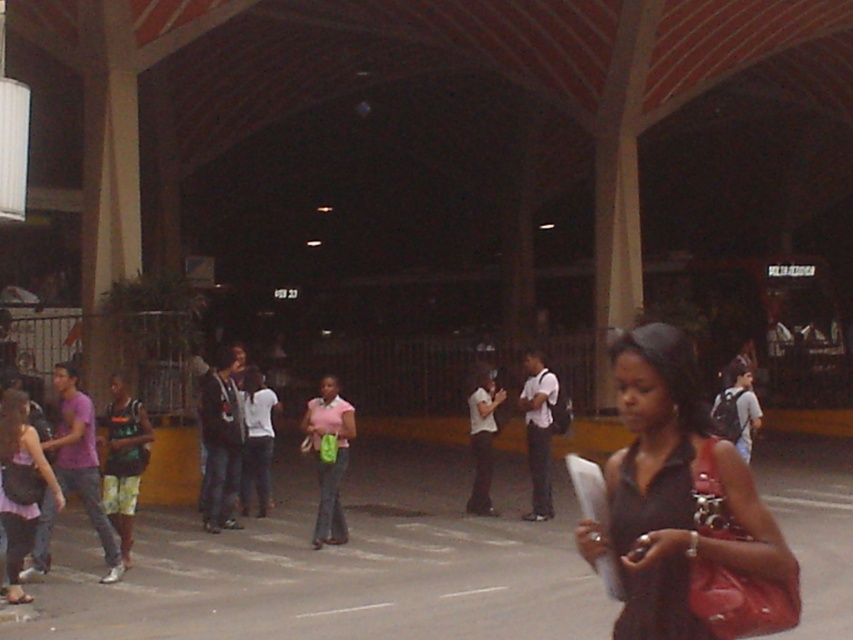
In the scene described, there are two clothing items visible. The matte black dress at center and the matte pink skirt at lower left. Which of these two items is positioned more to the right side of the image?

The matte black dress at center is positioned to the right of the matte pink skirt at lower left, so the matte black dress at center is more to the right.